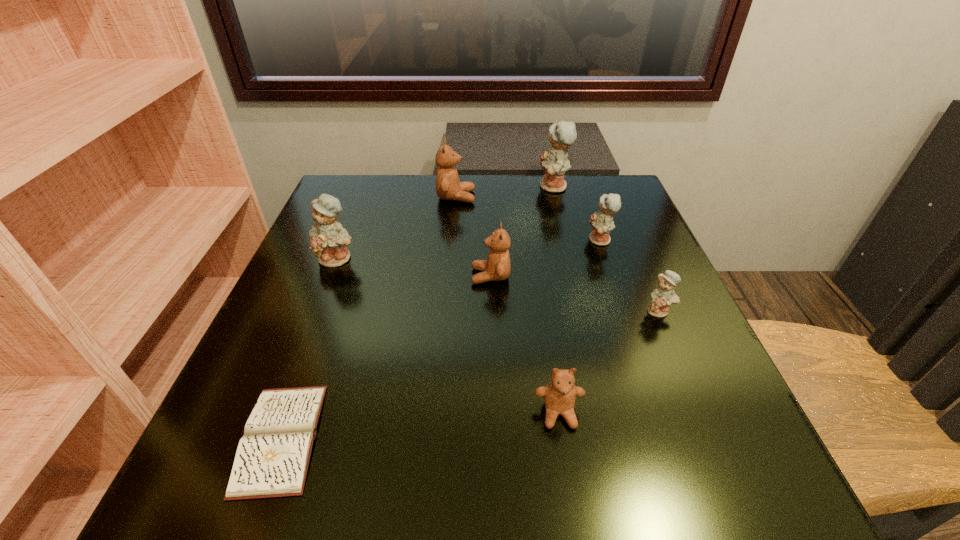
At what (x,y) coordinates should I click in order to perform the action: click on unoccupied area between the rightmost object and the biggest brown teddy bear. Please return your answer as a coordinate pair (x, y). The height and width of the screenshot is (540, 960). Looking at the image, I should click on (558, 254).

You are a GUI agent. You are given a task and a screenshot of the screen. Output one action in this format:
    pyautogui.click(x=<x>, y=<y>)
    Task: Click on the empty space that is in between the leftmost blue teddy bear and the second blue teddy bear from right to left
    
    Given the screenshot: What is the action you would take?
    pyautogui.click(x=468, y=249)

Find the location of a particular element. unoccupied area between the rightmost brown teddy bear and the third blue teddy bear from left to right is located at coordinates pyautogui.click(x=579, y=327).

At what (x,y) coordinates should I click in order to perform the action: click on vacant area between the farthest blue teddy bear and the leftmost blue teddy bear. Please return your answer as a coordinate pair (x, y). The image size is (960, 540). Looking at the image, I should click on (445, 223).

Identify the location of vacant region between the seventh object from left to right and the leftmost blue teddy bear. Image resolution: width=960 pixels, height=540 pixels. (468, 249).

The height and width of the screenshot is (540, 960). Find the location of `free space that is in between the leftmost blue teddy bear and the sixth teddy bear from left to right`. free space that is in between the leftmost blue teddy bear and the sixth teddy bear from left to right is located at coordinates (468, 249).

You are a GUI agent. You are given a task and a screenshot of the screen. Output one action in this format:
    pyautogui.click(x=<x>, y=<y>)
    Task: Click on the free spot between the biggest blue teddy bear and the nearest brown teddy bear
    The height and width of the screenshot is (540, 960).
    Given the screenshot: What is the action you would take?
    pyautogui.click(x=556, y=300)

The width and height of the screenshot is (960, 540). In order to click on vacant point located between the leftmost blue teddy bear and the second nearest teddy bear in this screenshot , I will do `click(498, 285)`.

You are a GUI agent. You are given a task and a screenshot of the screen. Output one action in this format:
    pyautogui.click(x=<x>, y=<y>)
    Task: Click on the vacant space that is in between the farthest brown teddy bear and the second teddy bear from right to left
    The height and width of the screenshot is (540, 960).
    Given the screenshot: What is the action you would take?
    pyautogui.click(x=528, y=219)

Identify which object is the sixth closest to the third biggest blue teddy bear. Please provide its 2D coordinates. Your answer should be formatted as a tuple, i.e. [(x, y)], where the tuple contains the x and y coordinates of a point satisfying the conditions above.

[(328, 239)]